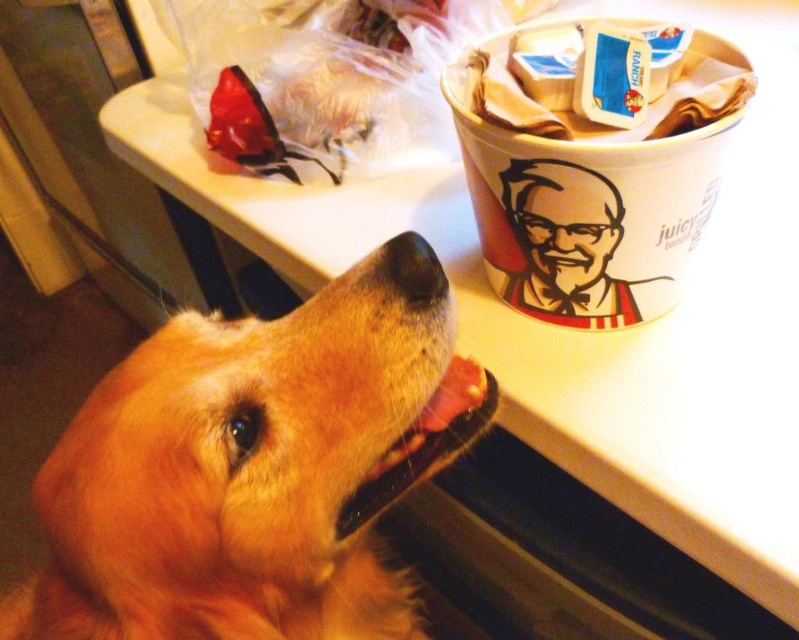
Question: Does golden fur dog at center appear on the left side of white paper cup at upper right?

Choices:
 (A) yes
 (B) no

Answer: (A)

Question: Which object is closer to the camera taking this photo?

Choices:
 (A) white paper cup at upper right
 (B) golden fur dog at center

Answer: (B)

Question: Is golden fur dog at center below white paper cup at upper right?

Choices:
 (A) no
 (B) yes

Answer: (B)

Question: Can you confirm if golden fur dog at center is positioned above white paper cup at upper right?

Choices:
 (A) yes
 (B) no

Answer: (B)